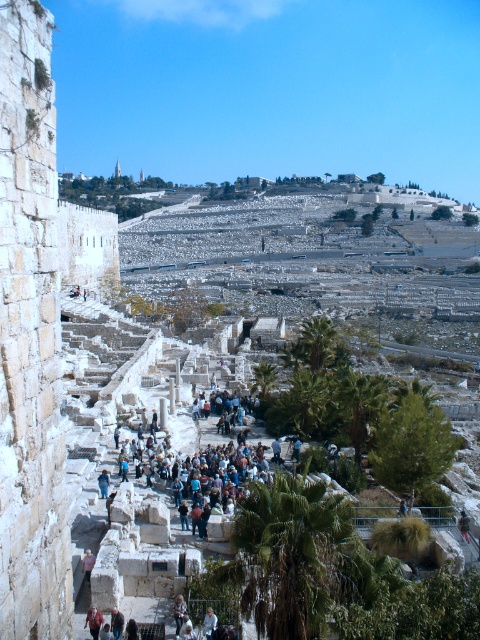
Question: From the image, what is the correct spatial relationship of green leafy palm tree at lower center in relation to green leafy palm tree at center?

Choices:
 (A) below
 (B) above

Answer: (A)

Question: Which point is farther from the camera taking this photo?

Choices:
 (A) (314, 346)
 (B) (300, 522)
 (C) (177, 605)
 (D) (214, 612)

Answer: (A)

Question: Which point is farther to the camera?

Choices:
 (A) (214, 612)
 (B) (323, 330)
 (C) (267, 588)

Answer: (B)

Question: Is green leafy palm tree at lower center to the right of light brown leather jacket at center from the viewer's perspective?

Choices:
 (A) no
 (B) yes

Answer: (B)

Question: Which point is closer to the camera?

Choices:
 (A) (304, 339)
 (B) (179, 632)
 (C) (334, 502)
 (D) (206, 611)

Answer: (C)

Question: Can you confirm if green leafy palm tree at center is positioned below light beige fabric at center?

Choices:
 (A) yes
 (B) no

Answer: (B)